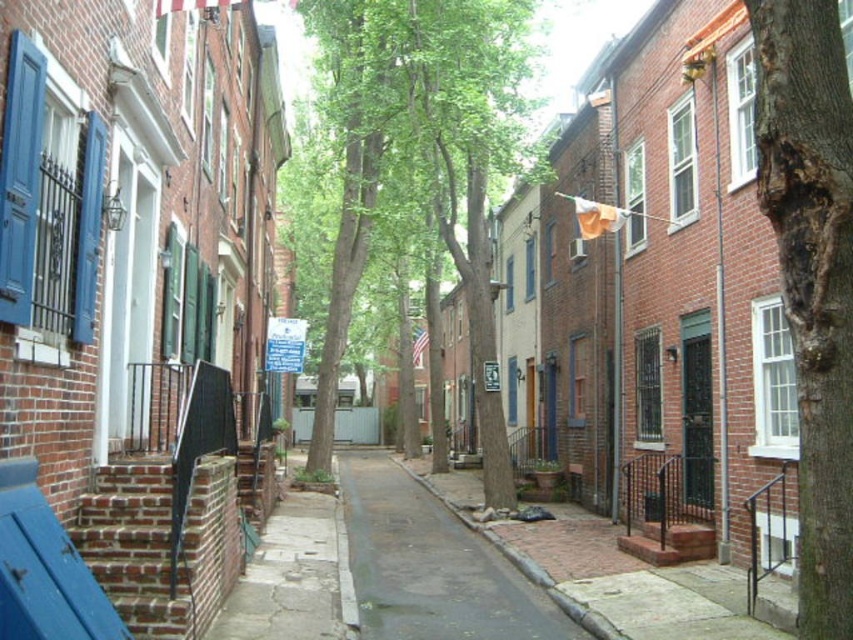
You are a city planner trying to determine if a new bench can be placed between the green leafy tree at center and the rough bark tree at right. The bench requires 1.2 meters of space. Can the bench fit in the space between them?

The green leafy tree at center is wider than the rough bark tree at right, but the description does not provide the exact distance between them. Therefore, it is unclear if the bench can fit in the space between them.

You are standing on the sidewalk of the quiet street and want to take a photo of both the point at coordinates (839, 554) and the point at coordinates (357, 518). Which point should you focus on first to ensure both are in clear view?

You should focus on the point at coordinates (839, 554) first because it is closer to the camera than the point at coordinates (357, 518). This ensures both points are in focus as the depth of field will likely cover the farther point when focusing on the closer one.

You are standing at the center of the street and want to reach the rough bark tree at right. Which direction should you move to get closer to it?

The rough bark tree at right is located at point (811,276), so you should move towards the right side of the street to reach it.